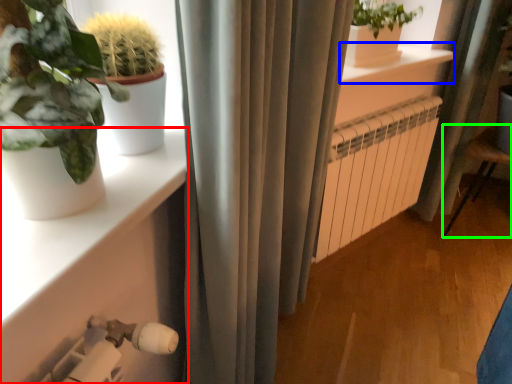
Question: Considering the real-world distances, which object is farthest from shelf (highlighted by a red box)? window sill (highlighted by a blue box) or armchair (highlighted by a green box)?

Choices:
 (A) window sill
 (B) armchair

Answer: (B)